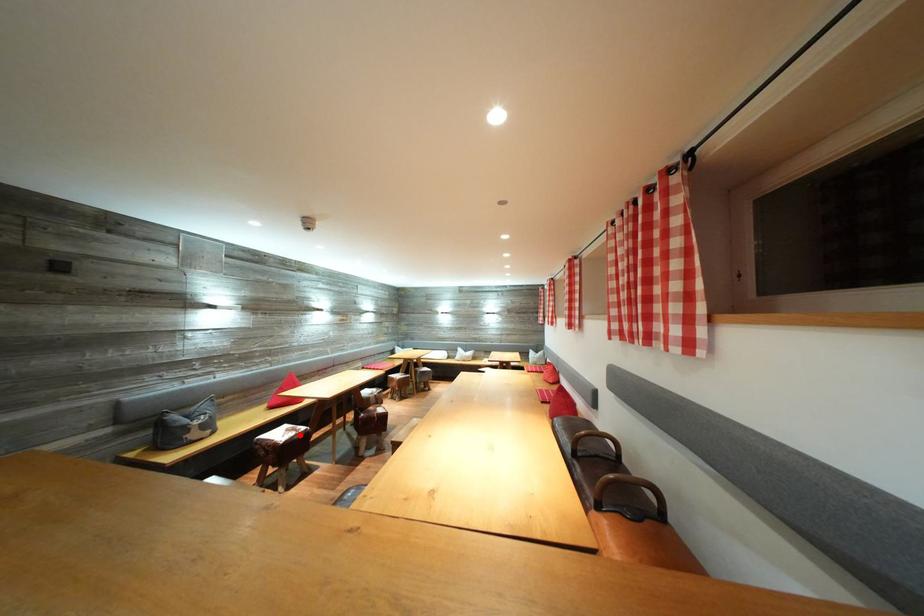
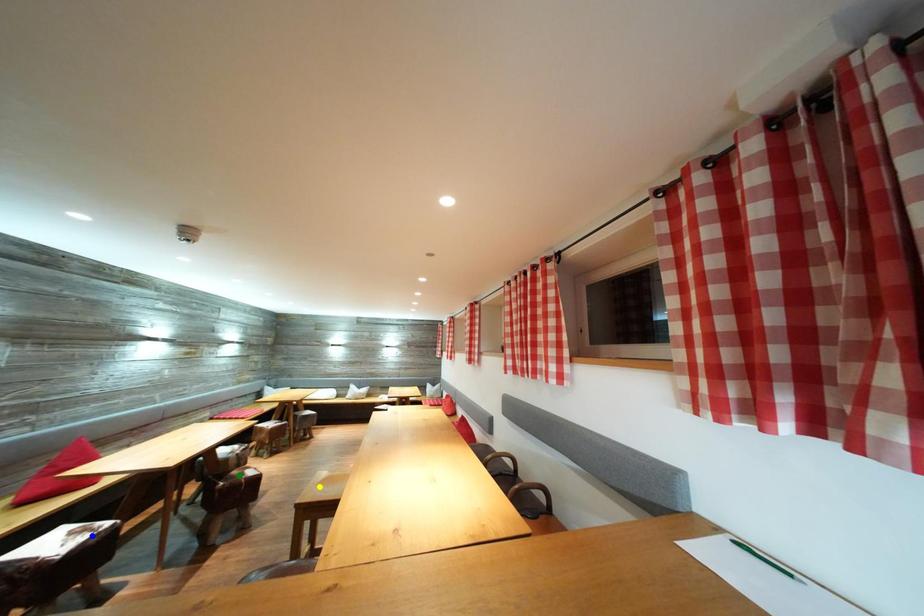
Question: I am providing you with two images of the same scene from different viewpoints. A red point is marked on the first image. You are given multiple points on the second image. In image 2, which mark is for the same physical point as the one in image 1?

Choices:
 (A) yellow point
 (B) green point
 (C) blue point

Answer: (C)